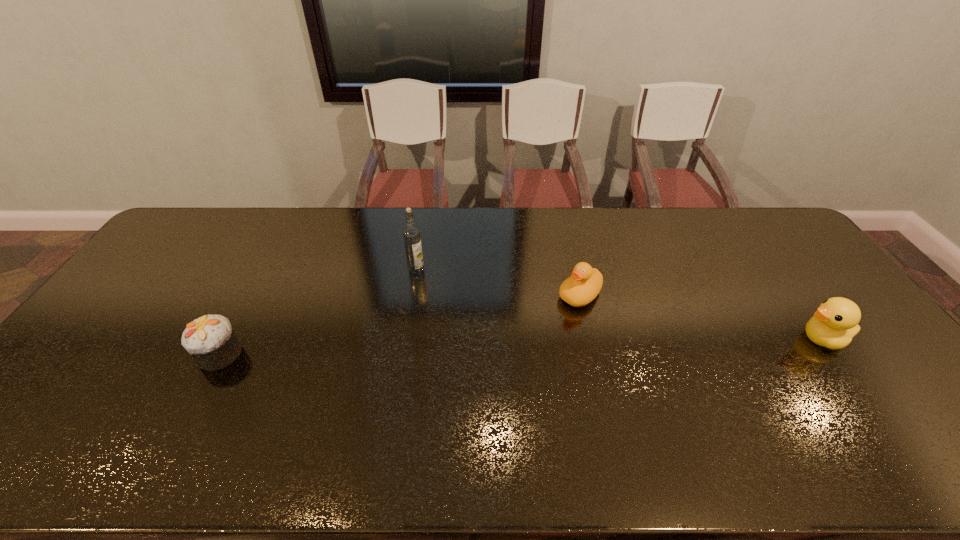
The height and width of the screenshot is (540, 960). I want to click on the leftmost object, so click(x=210, y=339).

This screenshot has width=960, height=540. What are the coordinates of `the right duck` in the screenshot? It's located at (835, 323).

What are the coordinates of `the nearer duck` in the screenshot? It's located at (835, 323).

Identify the location of the farthest object. The width and height of the screenshot is (960, 540). (412, 240).

This screenshot has width=960, height=540. What are the coordinates of `vodka` in the screenshot? It's located at (412, 240).

Find the location of a particular element. Image resolution: width=960 pixels, height=540 pixels. the farther duck is located at coordinates (585, 283).

Where is `the left duck`? This screenshot has width=960, height=540. the left duck is located at coordinates tap(585, 283).

You are a GUI agent. You are given a task and a screenshot of the screen. Output one action in this format:
    pyautogui.click(x=<x>, y=<y>)
    Task: Click on the vacant space located 0.180m on the back of the leftmost object
    The image size is (960, 540).
    Given the screenshot: What is the action you would take?
    pyautogui.click(x=252, y=292)

In order to click on vacant point located 0.290m on the face of the rightmost object in this screenshot , I will do `click(692, 339)`.

Identify the location of vacant space located 0.230m on the face of the rightmost object. The image size is (960, 540). (714, 339).